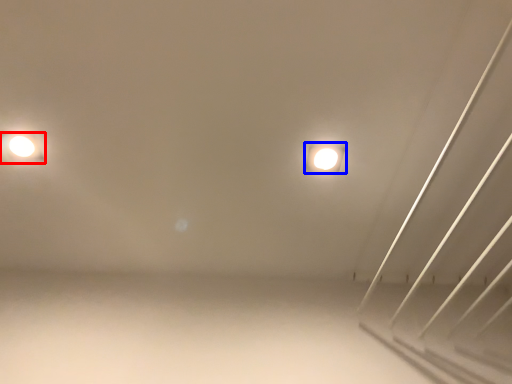
Question: Which of the following is the farthest to the observer, lamp (highlighted by a red box) or lamp (highlighted by a blue box)?

Choices:
 (A) lamp
 (B) lamp

Answer: (B)